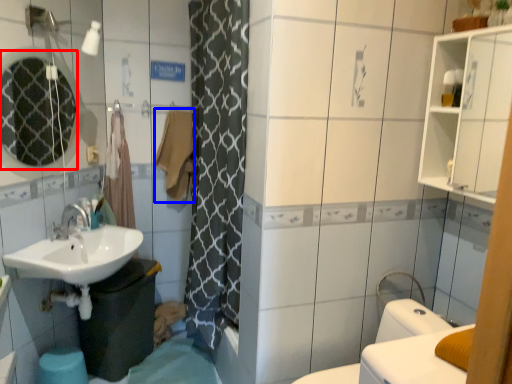
Question: Which object is closer to the camera taking this photo, mirror (highlighted by a red box) or bath towel (highlighted by a blue box)?

Choices:
 (A) mirror
 (B) bath towel

Answer: (A)